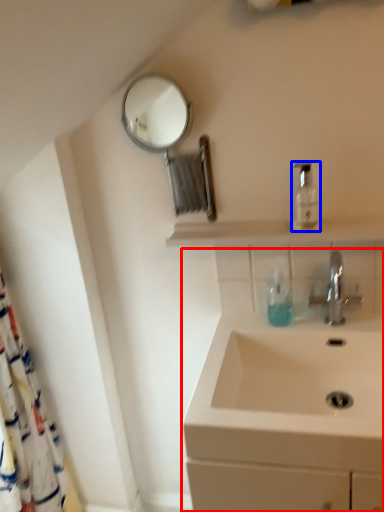
Question: Which object is further to the camera taking this photo, sink (highlighted by a red box) or mouthwash (highlighted by a blue box)?

Choices:
 (A) sink
 (B) mouthwash

Answer: (B)